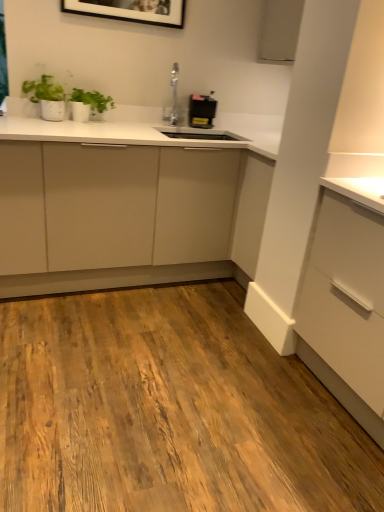
Question: Is the position of black plastic toaster at upper center less distant than that of matte white cabinet at center?

Choices:
 (A) no
 (B) yes

Answer: (A)

Question: Is black plastic toaster at upper center at the left side of matte white cabinet at center?

Choices:
 (A) no
 (B) yes

Answer: (A)

Question: Can you confirm if black plastic toaster at upper center is shorter than matte white cabinet at center?

Choices:
 (A) no
 (B) yes

Answer: (B)

Question: Does black plastic toaster at upper center have a greater width compared to matte white cabinet at center?

Choices:
 (A) no
 (B) yes

Answer: (A)

Question: From the image's perspective, does black plastic toaster at upper center appear higher than matte white cabinet at center?

Choices:
 (A) no
 (B) yes

Answer: (B)

Question: In the image, is green matte plant at upper left positioned in front of or behind matte white cabinet at center?

Choices:
 (A) behind
 (B) front

Answer: (A)

Question: In the image, is green matte plant at upper left on the left side or the right side of matte white cabinet at center?

Choices:
 (A) left
 (B) right

Answer: (A)

Question: Do you think green matte plant at upper left is within matte white cabinet at center, or outside of it?

Choices:
 (A) outside
 (B) inside

Answer: (B)

Question: Considering the positions of green matte plant at upper left and matte white cabinet at center in the image, is green matte plant at upper left taller or shorter than matte white cabinet at center?

Choices:
 (A) short
 (B) tall

Answer: (A)

Question: In the image, is black plastic toaster at upper center on the left side or the right side of matte white dresser at center?

Choices:
 (A) left
 (B) right

Answer: (B)

Question: In the image, is black plastic toaster at upper center positioned in front of or behind matte white dresser at center?

Choices:
 (A) behind
 (B) front

Answer: (A)

Question: From the image's perspective, relative to matte white dresser at center, is black plastic toaster at upper center above or below?

Choices:
 (A) below
 (B) above

Answer: (B)

Question: Is black plastic toaster at upper center bigger or smaller than matte white dresser at center?

Choices:
 (A) small
 (B) big

Answer: (A)

Question: Considering the relative positions of black plastic toaster at upper center and matte white cabinet at center in the image provided, is black plastic toaster at upper center to the left or to the right of matte white cabinet at center?

Choices:
 (A) right
 (B) left

Answer: (A)

Question: From the image's perspective, relative to matte white cabinet at center, is black plastic toaster at upper center above or below?

Choices:
 (A) below
 (B) above

Answer: (B)